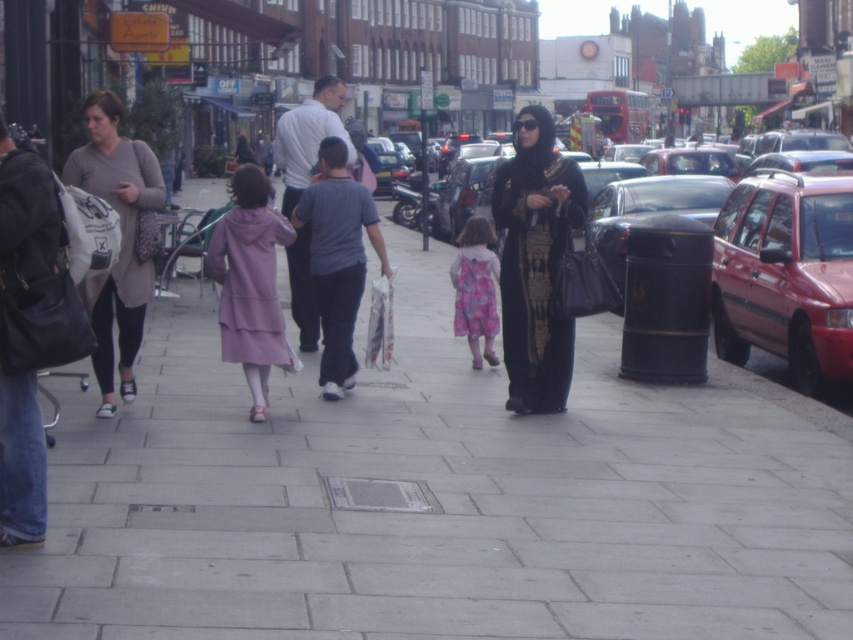
You are a delivery person trying to navigate through the urban street scene. You need to place a package on the gray concrete sidewalk at center, but there is a metallic red station wagon at right blocking the path. Based on their positions, can you determine if the sidewalk is accessible from the wagon side?

The gray concrete sidewalk at center is to the left of the metallic red station wagon at right, meaning the wagon is positioned to the right of the sidewalk. Since the sidewalk is on the left side relative to the wagon, you can access the gray concrete sidewalk at center from the wagon side by moving towards the left.

You are a pedestrian on the sidewalk. You see the metallic red station wagon at right and the matte gray sweater at left. Which object is positioned further to the right?

The metallic red station wagon at right is positioned further to the right than the matte gray sweater at left.

You are standing on the sidewalk in the scene and want to move from point A to point B. Point A is at coordinates point (656, 164) and point B is at coordinates point (106, 160). Which direction should you move to get closer to point B?

To move from point A at (656, 164) to point B at (106, 160), you should move downward and slightly to the left because point B is lower and to the left of point A in the image.